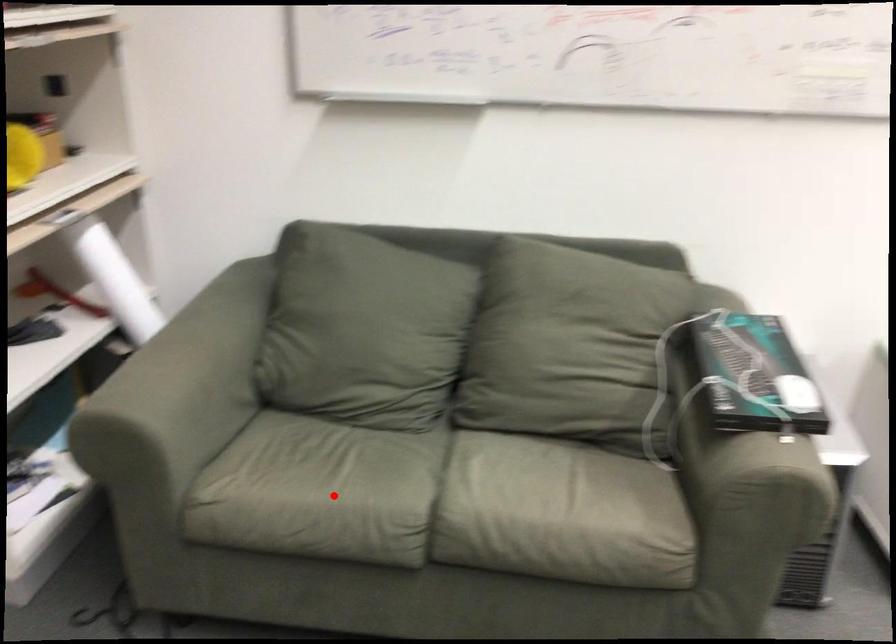
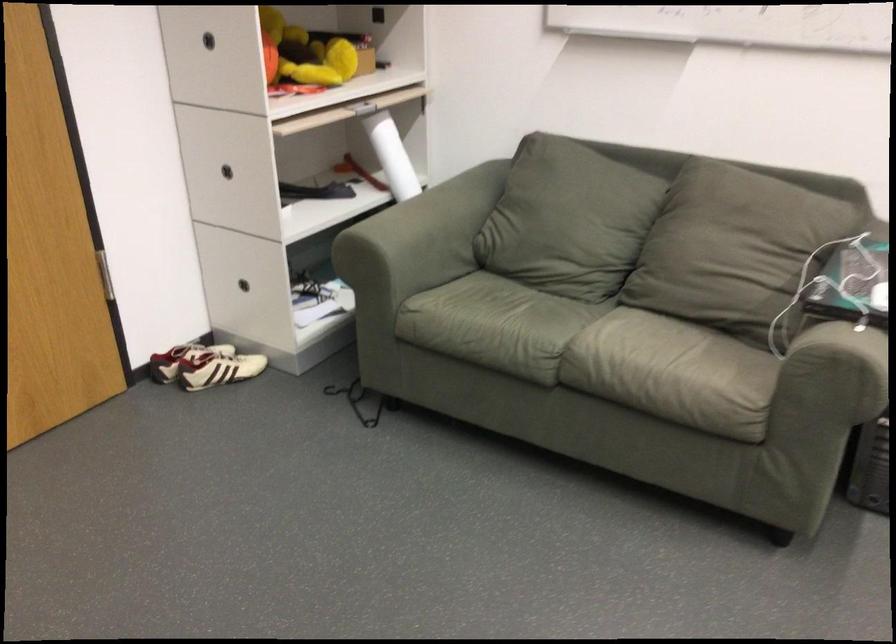
Question: I am providing you with two images of the same scene from different viewpoints. A red point is shown in image1. For the corresponding object point in image2, is it positioned nearer or farther from the camera?

Choices:
 (A) Nearer
 (B) Farther

Answer: (B)